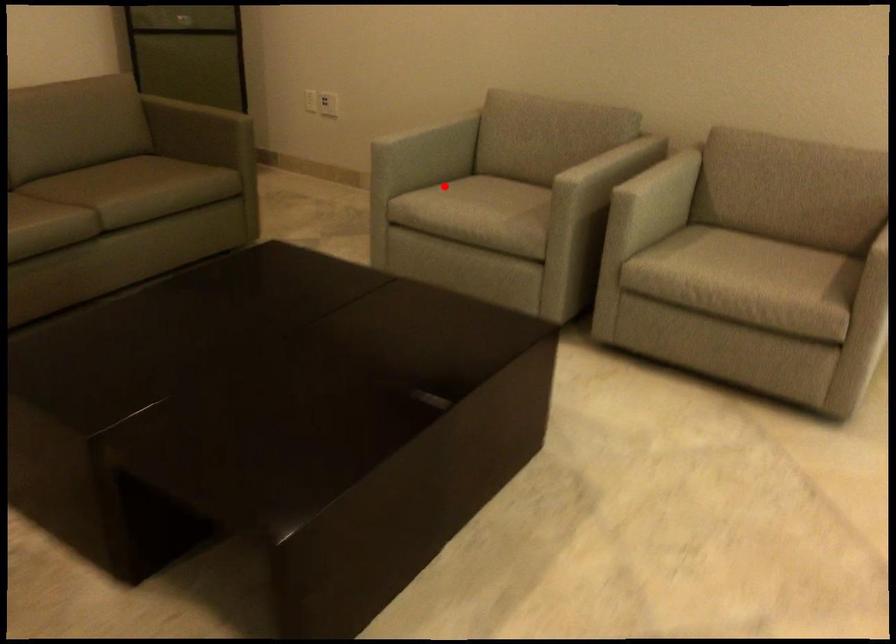
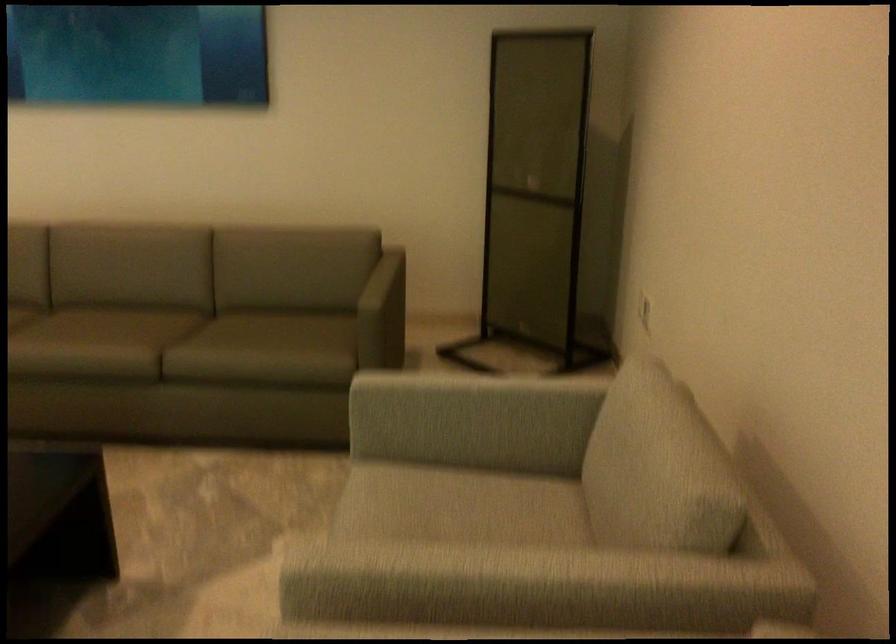
Question: I am providing you with two images of the same scene from different viewpoints. A red point is shown in image1. For the corresponding object point in image2, is it positioned nearer or farther from the camera?

Choices:
 (A) Nearer
 (B) Farther

Answer: (A)